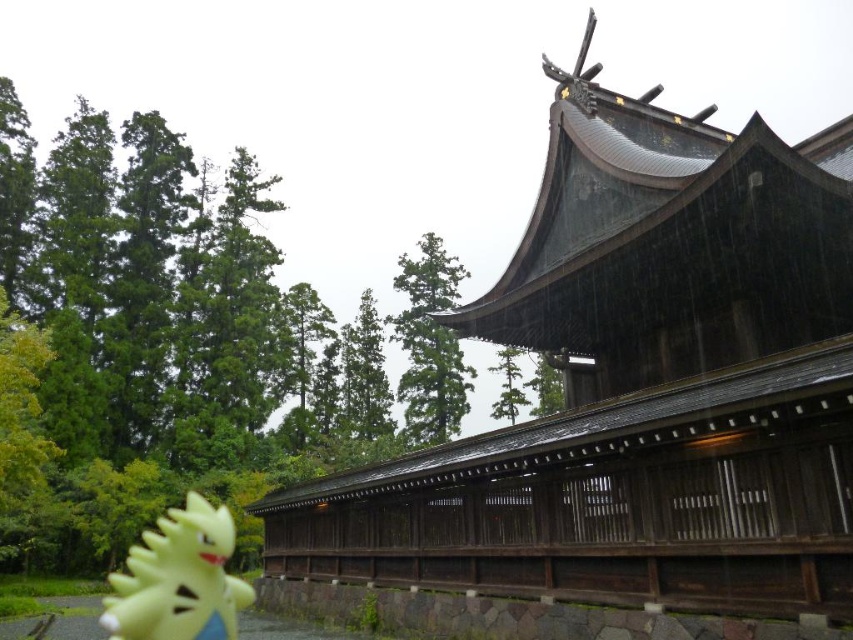
Question: Among these points, which one is farthest from the camera?

Choices:
 (A) (189, 602)
 (B) (767, 252)

Answer: (B)

Question: Among these points, which one is nearest to the camera?

Choices:
 (A) (204, 572)
 (B) (606, 454)

Answer: (A)

Question: In this image, where is shiny dark wood temple at upper center located relative to yellow rubber toy at lower left?

Choices:
 (A) right
 (B) left

Answer: (A)

Question: Which object is farther from the camera taking this photo?

Choices:
 (A) shiny dark wood temple at upper center
 (B) yellow rubber toy at lower left

Answer: (A)

Question: Is shiny dark wood temple at upper center to the left of yellow rubber toy at lower left from the viewer's perspective?

Choices:
 (A) yes
 (B) no

Answer: (B)

Question: Can you confirm if shiny dark wood temple at upper center is positioned to the left of yellow rubber toy at lower left?

Choices:
 (A) yes
 (B) no

Answer: (B)